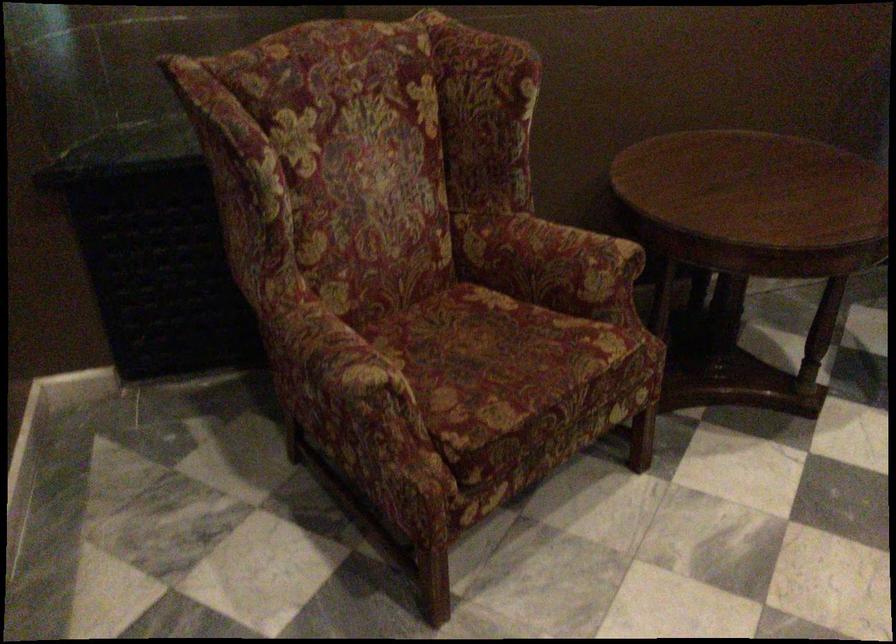
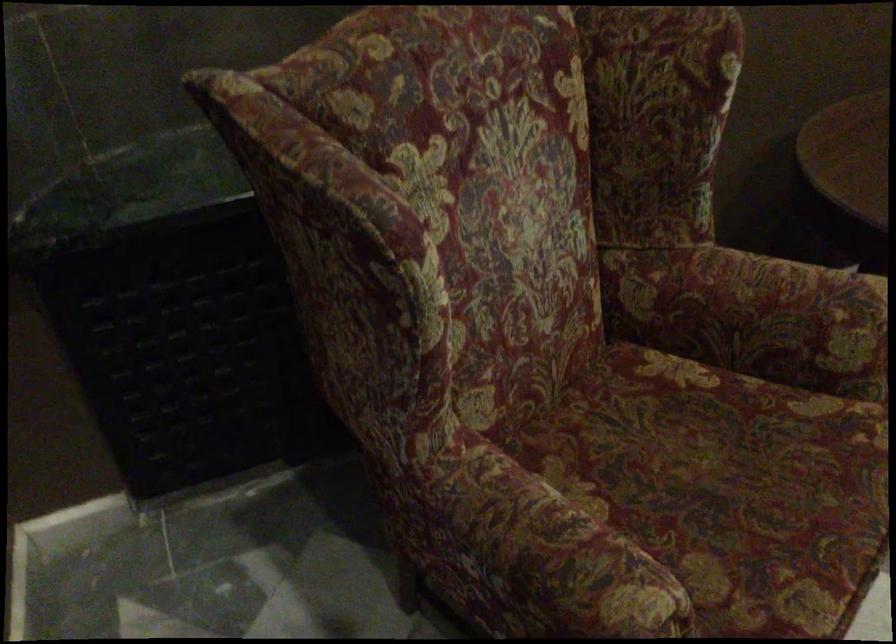
Locate, in the second image, the point that corresponds to pixel 563 263 in the first image.

(786, 321)